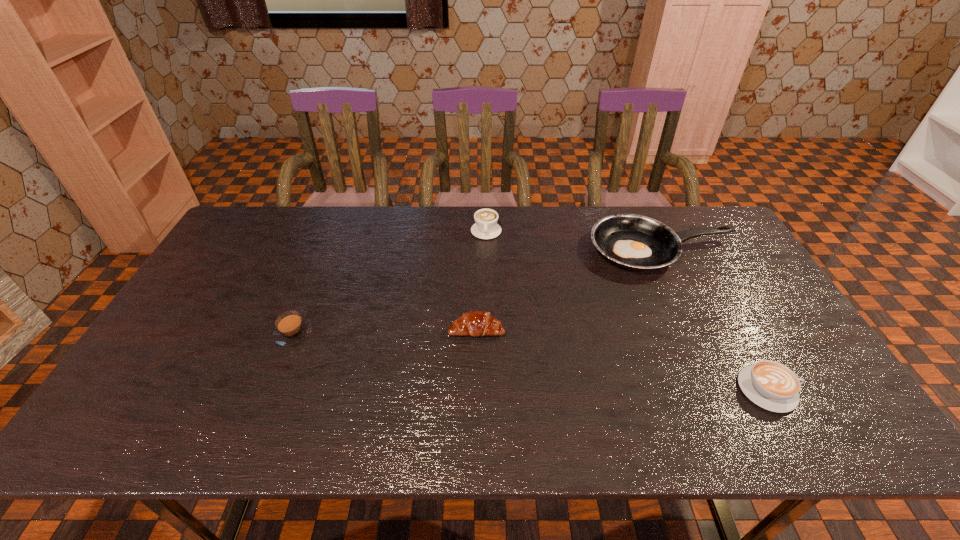
At what (x,y) coordinates should I click in order to perform the action: click on unoccupied area between the nearest object and the leftmost cappuccino. Please return your answer as a coordinate pair (x, y). The width and height of the screenshot is (960, 540). Looking at the image, I should click on (531, 361).

Locate an element on the screen. The height and width of the screenshot is (540, 960). vacant region between the farthest cappuccino and the leftmost cappuccino is located at coordinates (390, 282).

Locate an element on the screen. This screenshot has width=960, height=540. vacant region between the crescent roll and the nearest object is located at coordinates (622, 359).

At what (x,y) coordinates should I click in order to perform the action: click on free area in between the frying pan and the nearest cappuccino. Please return your answer as a coordinate pair (x, y). The width and height of the screenshot is (960, 540). Looking at the image, I should click on (715, 320).

You are a GUI agent. You are given a task and a screenshot of the screen. Output one action in this format:
    pyautogui.click(x=<x>, y=<y>)
    Task: Click on the blank region between the crescent roll and the frying pan
    This screenshot has height=540, width=960.
    Given the screenshot: What is the action you would take?
    pyautogui.click(x=569, y=289)

Where is `object that stands as the third closest to the frying pan`? object that stands as the third closest to the frying pan is located at coordinates (476, 323).

The width and height of the screenshot is (960, 540). In order to click on the fourth closest object to the tallest cappuccino in this screenshot , I will do `click(771, 385)`.

Choose which cappuccino is the nearest neighbor to the frying pan. Please provide its 2D coordinates. Your answer should be formatted as a tuple, i.e. [(x, y)], where the tuple contains the x and y coordinates of a point satisfying the conditions above.

[(485, 227)]

Identify the location of cappuccino that is the third nearest to the crescent roll. This screenshot has width=960, height=540. (771, 385).

The width and height of the screenshot is (960, 540). Identify the location of vacant space that satisfies the following two spatial constraints: 1. to the right of the tallest object's handle; 2. on the left side of the frying pan. [x=487, y=250].